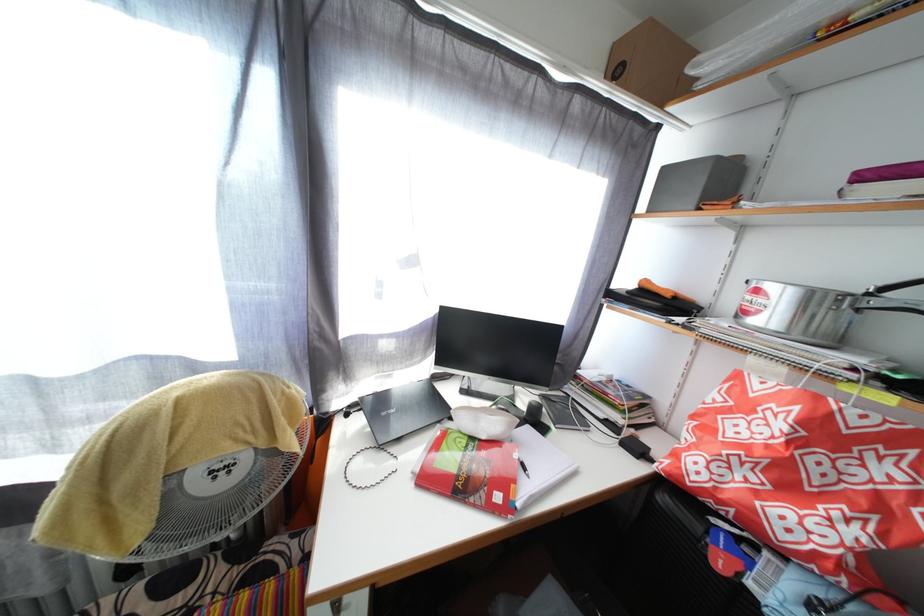
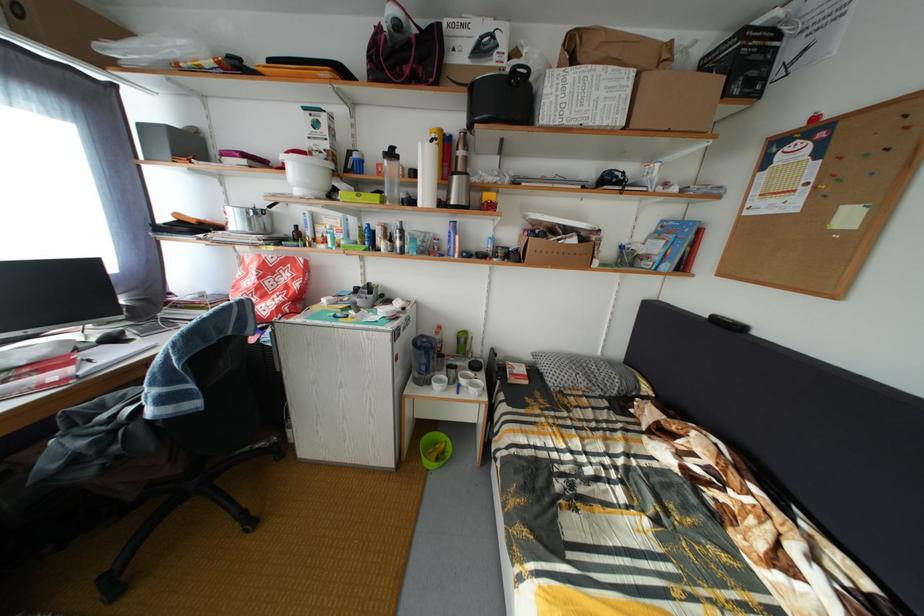
Locate, in the second image, the point that corresponds to [865,428] in the first image.

(281, 267)